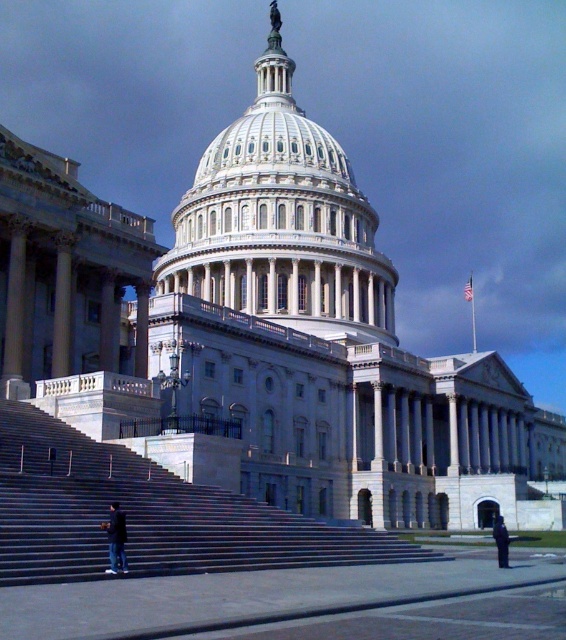
Image resolution: width=566 pixels, height=640 pixels. In order to click on gray concrete stairs at lower left in this screenshot , I will do `click(147, 515)`.

In the scene shown: Can you confirm if gray concrete stairs at lower left is positioned below dark blue uniform at lower right?

No.

The height and width of the screenshot is (640, 566). I want to click on gray concrete stairs at lower left, so click(147, 515).

Looking at this image, is dark blue jeans at lower left wider than dark blue uniform at lower right?

No.

Who is more forward, (x=123, y=566) or (x=505, y=545)?

Point (x=123, y=566) is in front.

Between point (118, 515) and point (508, 564), which one is positioned in front?

Point (118, 515)

Where is `dark blue jeans at lower left`? dark blue jeans at lower left is located at coordinates (115, 540).

Is gray concrete stairs at lower left positioned behind dark blue jeans at lower left?

No, it is in front of dark blue jeans at lower left.

Between point (71, 440) and point (117, 541), which one is positioned behind?

Positioned behind is point (71, 440).

Is point (413, 547) positioned after point (123, 518)?

Yes, point (413, 547) is farther from viewer.

You are a GUI agent. You are given a task and a screenshot of the screen. Output one action in this format:
    pyautogui.click(x=<x>, y=<y>)
    Task: Click on the gray concrete stairs at lower left
    This screenshot has height=640, width=566.
    Given the screenshot: What is the action you would take?
    pyautogui.click(x=147, y=515)